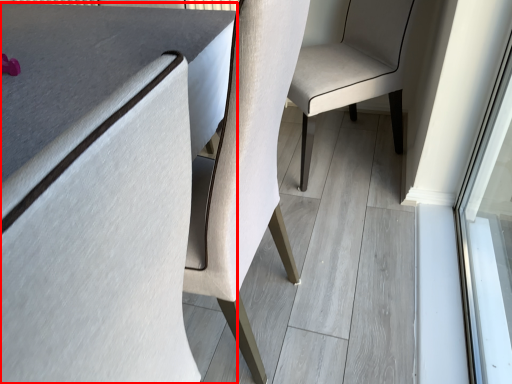
Question: From the image's perspective, what is the correct spatial positioning of table (annotated by the red box) in reference to chair?

Choices:
 (A) below
 (B) above

Answer: (A)